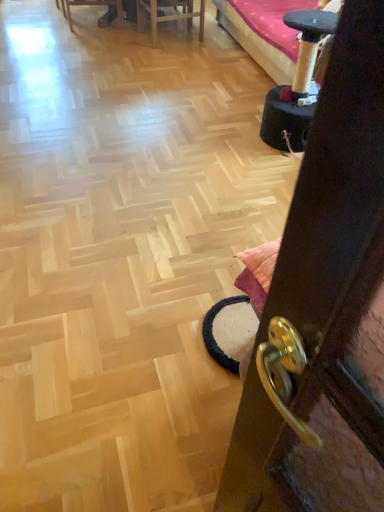
What do you see at coordinates (169, 15) in the screenshot? I see `wooden chair at upper center` at bounding box center [169, 15].

Identify the location of wooden chair at upper center. (169, 15).

The height and width of the screenshot is (512, 384). Find the location of `wooden chair at upper center`. wooden chair at upper center is located at coordinates (169, 15).